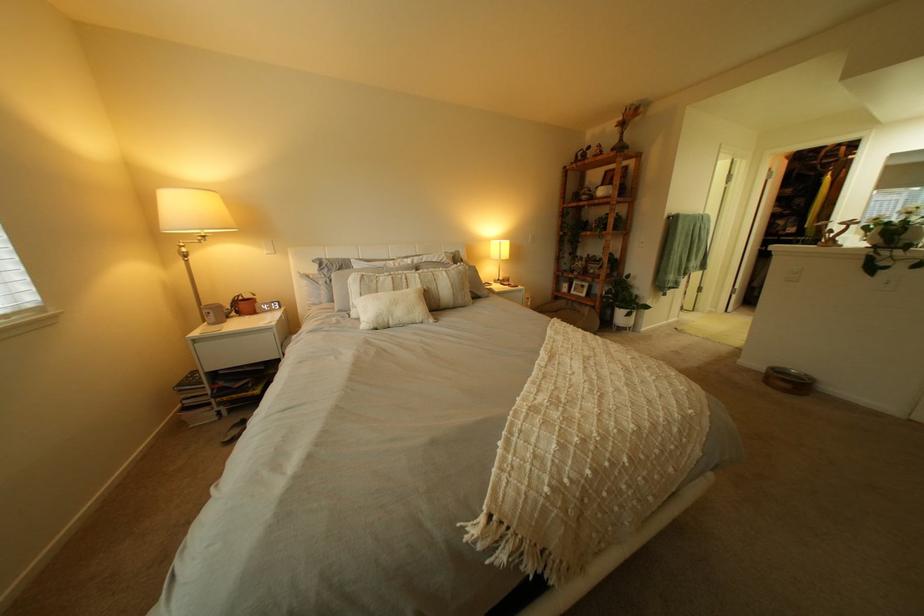
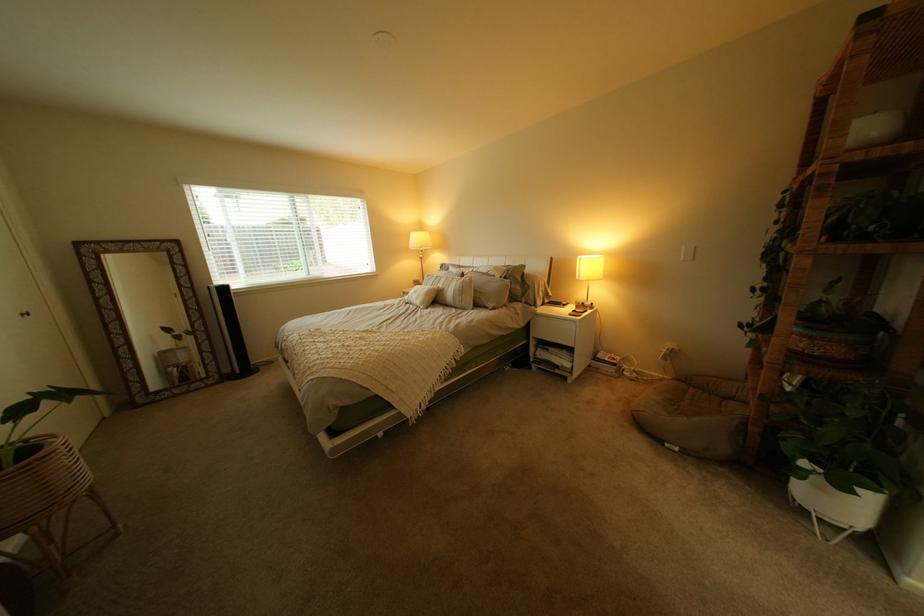
Find the pixel in the second image that matches the point at 409,304 in the first image.

(431, 293)